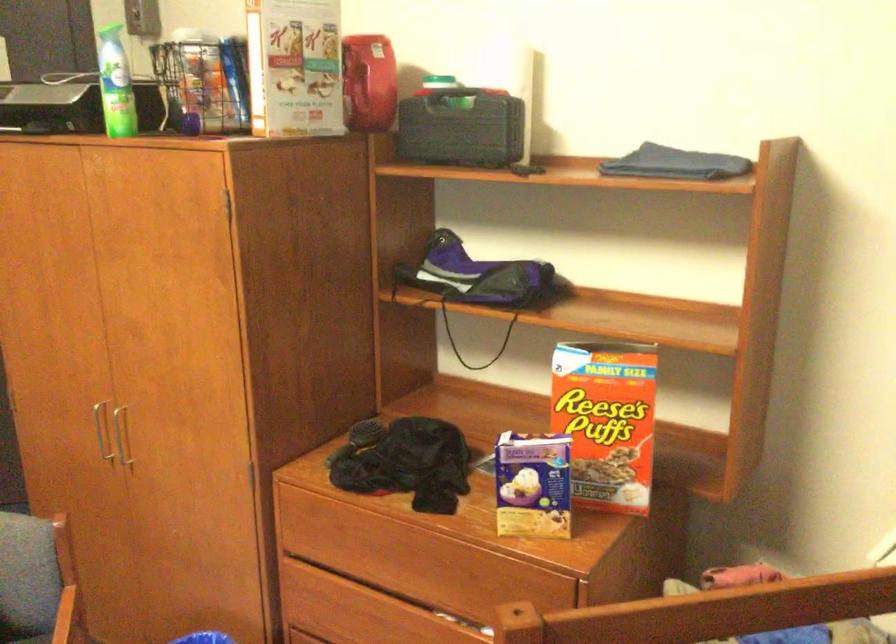
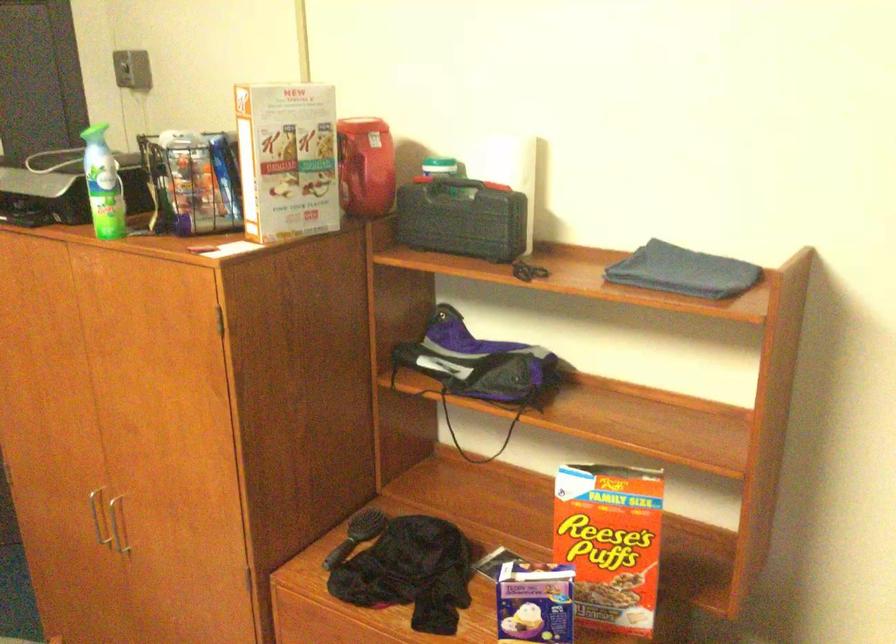
Question: The first image is from the beginning of the video and the second image is from the end. How did the camera likely rotate when shooting the video?

Choices:
 (A) Left
 (B) Right
 (C) Up
 (D) Down

Answer: (D)